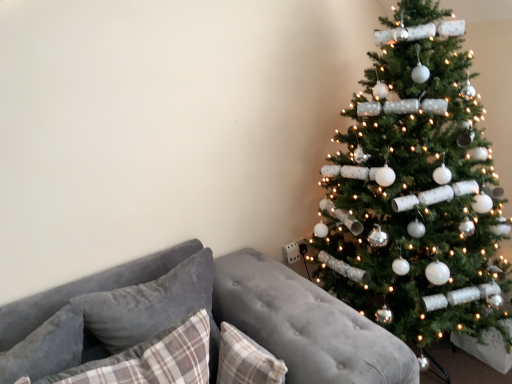
Question: Does velvety gray pillow at left, which is the second pillow from left to right, have a lesser height compared to plaid fabric pillow at lower left, which is counted as the 2th pillow, starting from the right?

Choices:
 (A) yes
 (B) no

Answer: (B)

Question: Is velvety gray pillow at left, which is the second pillow from left to right, thinner than plaid fabric pillow at lower left, which is the third pillow in left-to-right order?

Choices:
 (A) no
 (B) yes

Answer: (B)

Question: From the image's perspective, is velvety gray pillow at left, which is the second pillow from left to right, located beneath plaid fabric pillow at lower left, which is counted as the 2th pillow, starting from the right?

Choices:
 (A) yes
 (B) no

Answer: (B)

Question: Is plaid fabric pillow at lower left, which is the third pillow in left-to-right order, located within velvety gray pillow at left, which is the second pillow from left to right?

Choices:
 (A) yes
 (B) no

Answer: (B)

Question: Is velvety gray pillow at left, which is the second pillow from left to right, at the right side of plaid fabric pillow at lower left, which is counted as the 2th pillow, starting from the right?

Choices:
 (A) yes
 (B) no

Answer: (B)

Question: Is gray fabric pillow at lower left, which is counted as the 1th pillow, starting from the left, bigger or smaller than velvet gray couch at lower left?

Choices:
 (A) big
 (B) small

Answer: (B)

Question: From their relative heights in the image, would you say gray fabric pillow at lower left, arranged as the 4th pillow when viewed from the right, is taller or shorter than velvet gray couch at lower left?

Choices:
 (A) short
 (B) tall

Answer: (A)

Question: Relative to velvet gray couch at lower left, is gray fabric pillow at lower left, which is counted as the 1th pillow, starting from the left, in front or behind?

Choices:
 (A) front
 (B) behind

Answer: (B)

Question: From a real-world perspective, is gray fabric pillow at lower left, which is counted as the 1th pillow, starting from the left, above or below velvet gray couch at lower left?

Choices:
 (A) below
 (B) above

Answer: (B)

Question: Which is correct: plaid fabric pillow at lower left, which is counted as the 2th pillow, starting from the right, is inside velvety gray pillow at left, the third pillow in the right-to-left sequence, or outside of it?

Choices:
 (A) inside
 (B) outside

Answer: (B)

Question: Based on their sizes in the image, would you say plaid fabric pillow at lower left, which is counted as the 2th pillow, starting from the right, is bigger or smaller than velvety gray pillow at left, the third pillow in the right-to-left sequence?

Choices:
 (A) big
 (B) small

Answer: (A)

Question: From the image's perspective, is plaid fabric pillow at lower left, which is counted as the 2th pillow, starting from the right, located above or below velvety gray pillow at left, which is the second pillow from left to right?

Choices:
 (A) above
 (B) below

Answer: (B)

Question: From a real-world perspective, is plaid fabric pillow at lower left, which is counted as the 2th pillow, starting from the right, physically located above or below velvety gray pillow at left, the third pillow in the right-to-left sequence?

Choices:
 (A) above
 (B) below

Answer: (B)

Question: Is plaid fabric pillow at lower left, which is the third pillow in left-to-right order, taller or shorter than gray fabric pillow at lower left, arranged as the 4th pillow when viewed from the right?

Choices:
 (A) short
 (B) tall

Answer: (B)

Question: In terms of width, does plaid fabric pillow at lower left, which is the third pillow in left-to-right order, look wider or thinner when compared to gray fabric pillow at lower left, arranged as the 4th pillow when viewed from the right?

Choices:
 (A) wide
 (B) thin

Answer: (A)